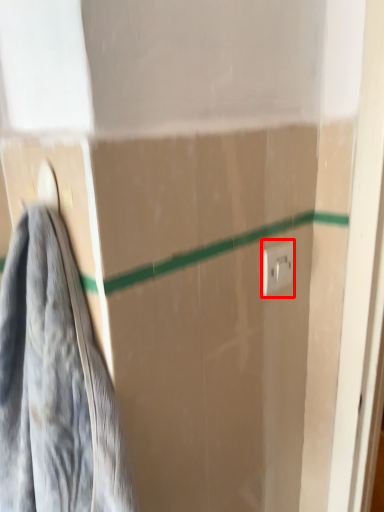
Question: From the image's perspective, considering the relative positions of electric outlet (annotated by the red box) and towel in the image provided, where is electric outlet (annotated by the red box) located with respect to the staircase?

Choices:
 (A) below
 (B) above

Answer: (B)